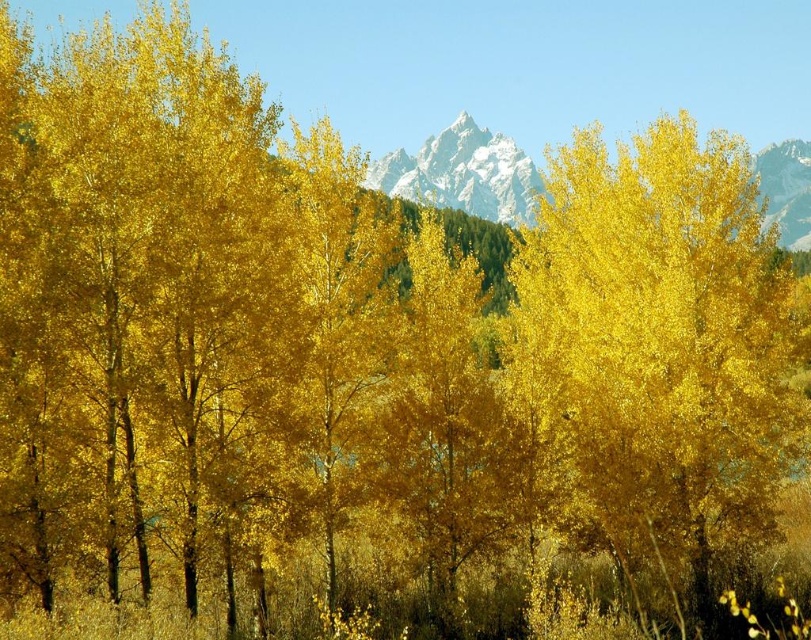
Question: Is golden glossy tree at center thinner than white crystalline mountain at center?

Choices:
 (A) no
 (B) yes

Answer: (B)

Question: Does golden glossy tree at center have a smaller size compared to white crystalline mountain at center?

Choices:
 (A) no
 (B) yes

Answer: (B)

Question: Which of the following is the closest to the observer?

Choices:
 (A) white crystalline mountain at center
 (B) golden glossy tree at center

Answer: (B)

Question: Which point is farther to the camera?

Choices:
 (A) (455, 180)
 (B) (715, 252)

Answer: (A)

Question: Can you confirm if golden glossy tree at center is smaller than white crystalline mountain at center?

Choices:
 (A) yes
 (B) no

Answer: (A)